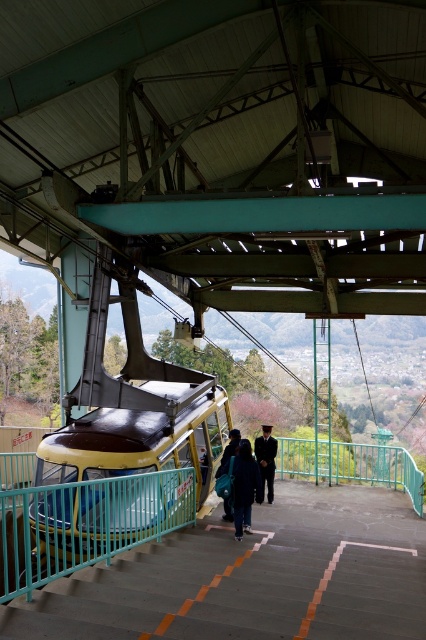
Question: Which point is closer to the camera?

Choices:
 (A) 235,520
 (B) 267,484

Answer: (A)

Question: Can you confirm if dark blue fabric jacket at center is bigger than dark blue uniform at center?

Choices:
 (A) no
 (B) yes

Answer: (B)

Question: Which of the following is the closest to the observer?

Choices:
 (A) dark blue uniform at center
 (B) black suit at center

Answer: (A)

Question: Is dark blue fabric jacket at center wider than black suit at center?

Choices:
 (A) yes
 (B) no

Answer: (A)

Question: Does dark blue fabric jacket at center appear under dark blue uniform at center?

Choices:
 (A) yes
 (B) no

Answer: (B)

Question: Which object is closer to the camera taking this photo?

Choices:
 (A) dark blue fabric jacket at center
 (B) black suit at center
 (C) dark blue uniform at center

Answer: (A)